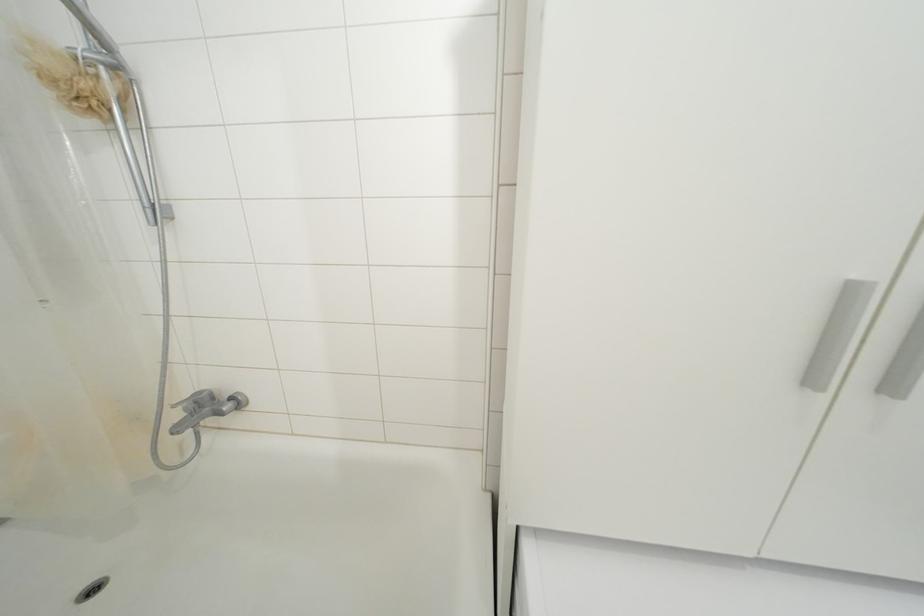
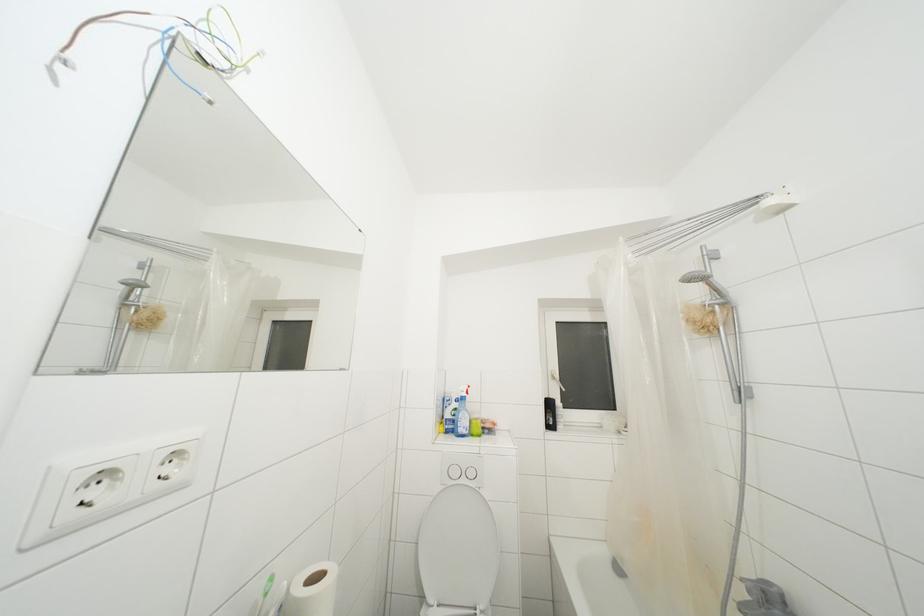
Question: The camera is either moving clockwise (left) or counter-clockwise (right) around the object. The first image is from the beginning of the video and the second image is from the end. Is the camera moving left or right when shooting the video?

Choices:
 (A) Left
 (B) Right

Answer: (B)